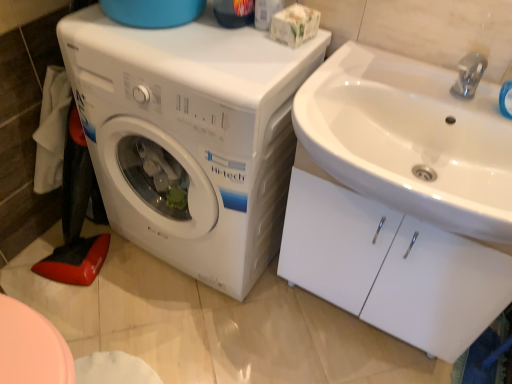
The width and height of the screenshot is (512, 384). I want to click on vacant area in front of white plastic washing machine at left, so click(x=185, y=331).